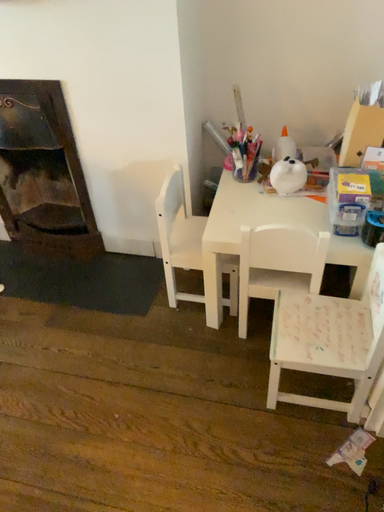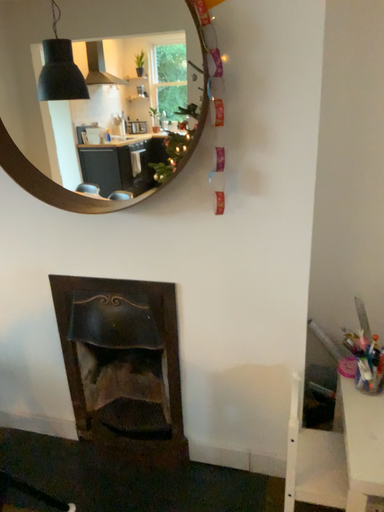
Question: How did the camera likely rotate when shooting the video?

Choices:
 (A) rotated downward
 (B) rotated upward

Answer: (B)